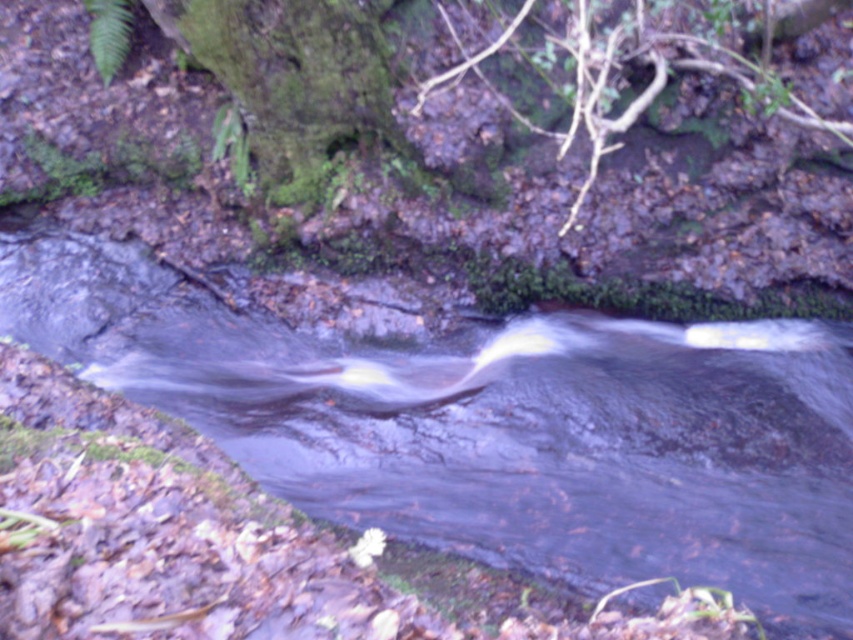
You are a hiker who wants to cross the stream safely. You see the clear water at center and the green mossy tree trunk at upper center. Which object is closer to you, and would stepping onto the mossy tree trunk provide a stable footing compared to the clear water area?

The clear water at center is closer to you than the green mossy tree trunk at upper center. Stepping onto the clear water area might be riskier due to its proximity and potential depth, while the green mossy tree trunk at upper center is farther away but could offer more stability if it is above the water.

You are a hiker who wants to cross the stream safely. You see the clear water at center and the green mossy tree trunk at upper center. Which object should you avoid stepping on to prevent slipping?

You should avoid stepping on the green mossy tree trunk at upper center because it is covered in moss, which can be slippery when wet. The clear water at center is the stream itself, so you should focus on finding stable rocks or a safe path across the stream.

You are a hiker who wants to cross the stream using the green mossy tree trunk at upper center as a bridge. Can you safely walk across the clear water at center using the tree trunk?

The clear water at center is bigger than the green mossy tree trunk at upper center, so the tree trunk may not be wide enough to safely cross the stream. You might need to find another path or a wider support.